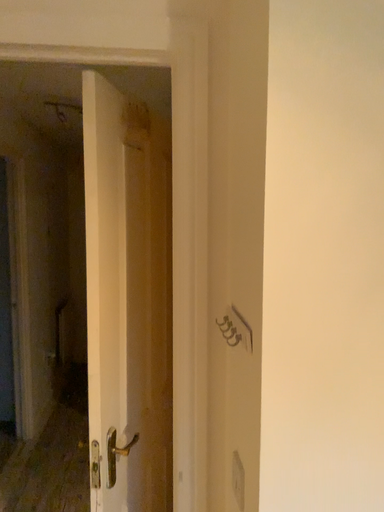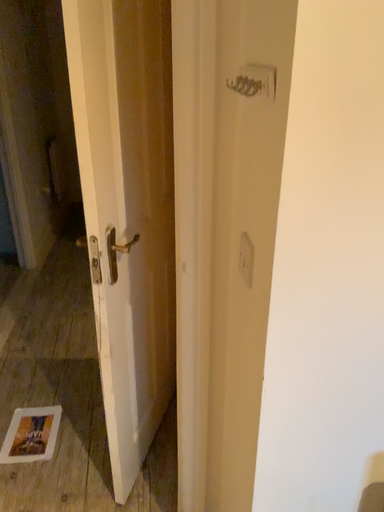
Question: How did the camera likely rotate when shooting the video?

Choices:
 (A) rotated downward
 (B) rotated upward

Answer: (A)